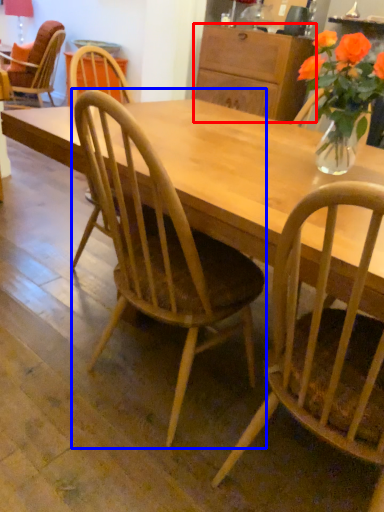
Question: Which object appears closest to the camera in this image, cabinetry (highlighted by a red box) or chair (highlighted by a blue box)?

Choices:
 (A) cabinetry
 (B) chair

Answer: (B)